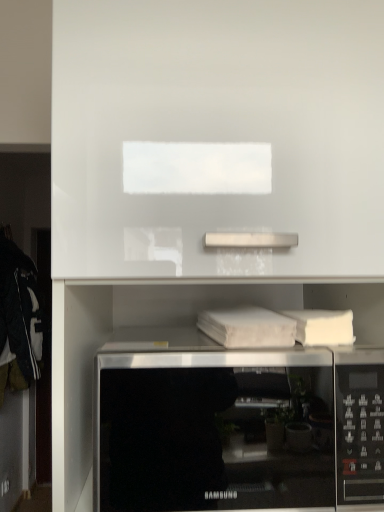
Question: Considering the positions of satin silver microwave at lower center and white matte book at center in the image, is satin silver microwave at lower center wider or thinner than white matte book at center?

Choices:
 (A) thin
 (B) wide

Answer: (B)

Question: Is point (172, 472) closer or farther from the camera than point (268, 312)?

Choices:
 (A) closer
 (B) farther

Answer: (A)

Question: Which is nearer to the white matte book at center?

Choices:
 (A) white glossy cabinet at upper center
 (B) satin silver microwave at lower center

Answer: (B)

Question: Based on their relative distances, which object is nearer to the satin silver microwave at lower center?

Choices:
 (A) white glossy cabinet at upper center
 (B) white matte book at center

Answer: (B)